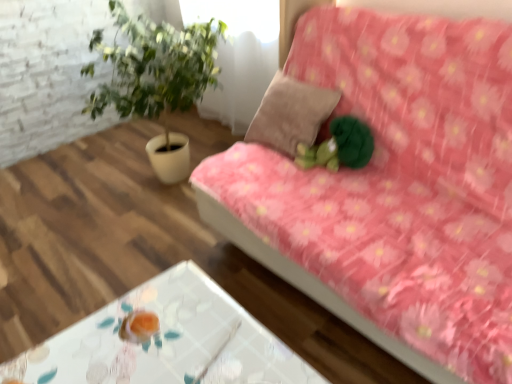
Question: From the image's perspective, is suede-like beige pillow at center over green plush toy at center?

Choices:
 (A) yes
 (B) no

Answer: (A)

Question: Is suede-like beige pillow at center wider than green plush toy at center?

Choices:
 (A) yes
 (B) no

Answer: (A)

Question: Is suede-like beige pillow at center at the right side of green plush toy at center?

Choices:
 (A) yes
 (B) no

Answer: (B)

Question: Can you confirm if suede-like beige pillow at center is smaller than green plush toy at center?

Choices:
 (A) no
 (B) yes

Answer: (A)

Question: Can you confirm if suede-like beige pillow at center is taller than green plush toy at center?

Choices:
 (A) no
 (B) yes

Answer: (B)

Question: From a real-world perspective, is suede-like beige pillow at center physically above green plush toy at center?

Choices:
 (A) yes
 (B) no

Answer: (A)

Question: Considering the relative positions of suede-like beige pillow at center and transparent glass table at lower center in the image provided, is suede-like beige pillow at center behind transparent glass table at lower center?

Choices:
 (A) no
 (B) yes

Answer: (B)

Question: Considering the relative sizes of suede-like beige pillow at center and transparent glass table at lower center in the image provided, is suede-like beige pillow at center wider than transparent glass table at lower center?

Choices:
 (A) no
 (B) yes

Answer: (A)

Question: Considering the relative sizes of suede-like beige pillow at center and transparent glass table at lower center in the image provided, is suede-like beige pillow at center bigger than transparent glass table at lower center?

Choices:
 (A) yes
 (B) no

Answer: (B)

Question: Are suede-like beige pillow at center and transparent glass table at lower center located far from each other?

Choices:
 (A) yes
 (B) no

Answer: (B)

Question: Is suede-like beige pillow at center in front of transparent glass table at lower center?

Choices:
 (A) yes
 (B) no

Answer: (B)

Question: Are suede-like beige pillow at center and transparent glass table at lower center beside each other?

Choices:
 (A) no
 (B) yes

Answer: (A)

Question: Is green plush toy at center shorter than suede-like beige pillow at center?

Choices:
 (A) yes
 (B) no

Answer: (A)